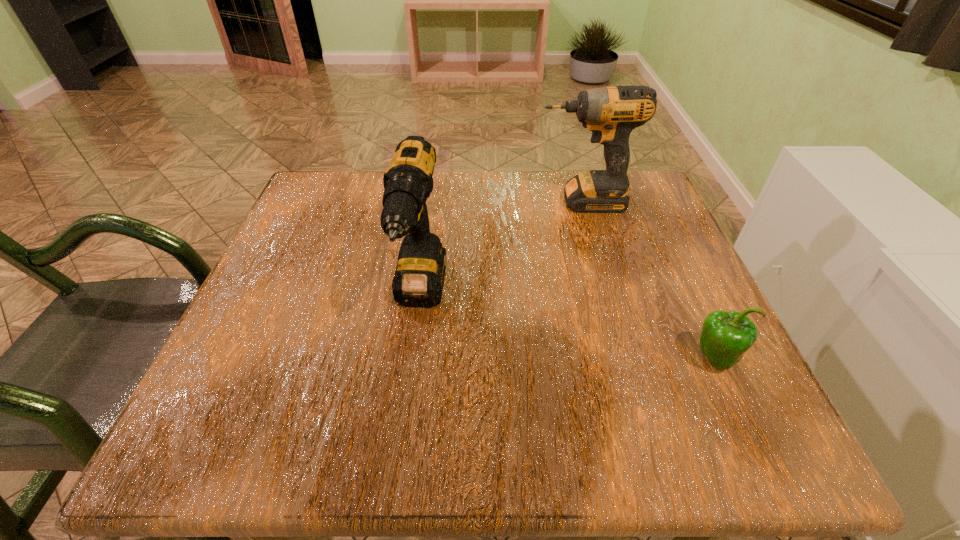
Point out which object is positioned as the second nearest to the farthest object. Please provide its 2D coordinates. Your answer should be formatted as a tuple, i.e. [(x, y)], where the tuple contains the x and y coordinates of a point satisfying the conditions above.

[(725, 336)]

Find the location of a particular element. object that is the nearest to the bell pepper is located at coordinates pos(611,113).

Identify the location of vacant region that satisfies the following two spatial constraints: 1. with the drill bit of the shortest object facing forward; 2. on the left side of the farthest object. (626, 358).

Locate an element on the screen. This screenshot has height=540, width=960. vacant area in the image that satisfies the following two spatial constraints: 1. with the drill bit of the bell pepper facing forward; 2. on the right side of the farther drill is located at coordinates (626, 358).

At what (x,y) coordinates should I click in order to perform the action: click on vacant space that satisfies the following two spatial constraints: 1. at the tip of the left drill; 2. on the left side of the shortest object. Please return your answer as a coordinate pair (x, y). This screenshot has height=540, width=960. Looking at the image, I should click on (412, 358).

This screenshot has width=960, height=540. Find the location of `vacant space that satisfies the following two spatial constraints: 1. with the drill bit of the right drill facing forward; 2. at the tip of the left drill`. vacant space that satisfies the following two spatial constraints: 1. with the drill bit of the right drill facing forward; 2. at the tip of the left drill is located at coordinates (609, 298).

I want to click on free space in the image that satisfies the following two spatial constraints: 1. at the tip of the shortest object; 2. on the left side of the left drill, so click(412, 358).

Locate an element on the screen. This screenshot has height=540, width=960. vacant area that satisfies the following two spatial constraints: 1. with the drill bit of the bell pepper facing forward; 2. on the left side of the right drill is located at coordinates (626, 358).

Identify the location of free point that satisfies the following two spatial constraints: 1. with the drill bit of the farthest object facing forward; 2. on the left side of the shortest object. This screenshot has width=960, height=540. (626, 358).

I want to click on vacant area in the image that satisfies the following two spatial constraints: 1. with the drill bit of the shortest object facing forward; 2. on the right side of the farther drill, so click(626, 358).